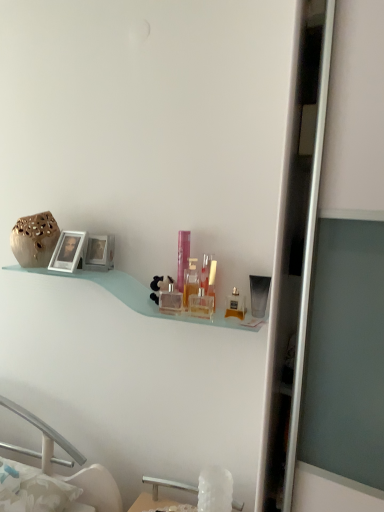
Question: From the image's perspective, is silver metallic picture frame at left, which is the second picture frame from right to left, above or below white crystal sink at lower center?

Choices:
 (A) below
 (B) above

Answer: (B)

Question: From their relative heights in the image, would you say silver metallic picture frame at left, acting as the first picture frame starting from the left, is taller or shorter than white crystal sink at lower center?

Choices:
 (A) short
 (B) tall

Answer: (B)

Question: Which object is the farthest from the metallic silver picture frame at upper left, which is the 2th picture frame from left to right?

Choices:
 (A) clear plastic bottle at center, the 4th toiletry when ordered from right to left
 (B) clear glass perfume bottle at center, which is the 1th toiletry from left to right
 (C) clear glass perfume bottle at center, positioned as the fifth toiletry in right-to-left order
 (D) white crystal sink at lower center
 (E) matte gold perfume at center, which appears as the 2th toiletry when viewed from the right

Answer: (D)

Question: Considering the real-world distances, which object is farthest from the white crystal sink at lower center?

Choices:
 (A) clear glass perfume bottle at center, the eighth toiletry in the right-to-left sequence
 (B) silver metallic picture frame at left, acting as the first picture frame starting from the left
 (C) white glossy table at lower center
 (D) translucent glass perfume bottle at center, which is the 6th toiletry from right to left
 (E) metallic silver picture frame at upper left, the first picture frame from the right

Answer: (B)